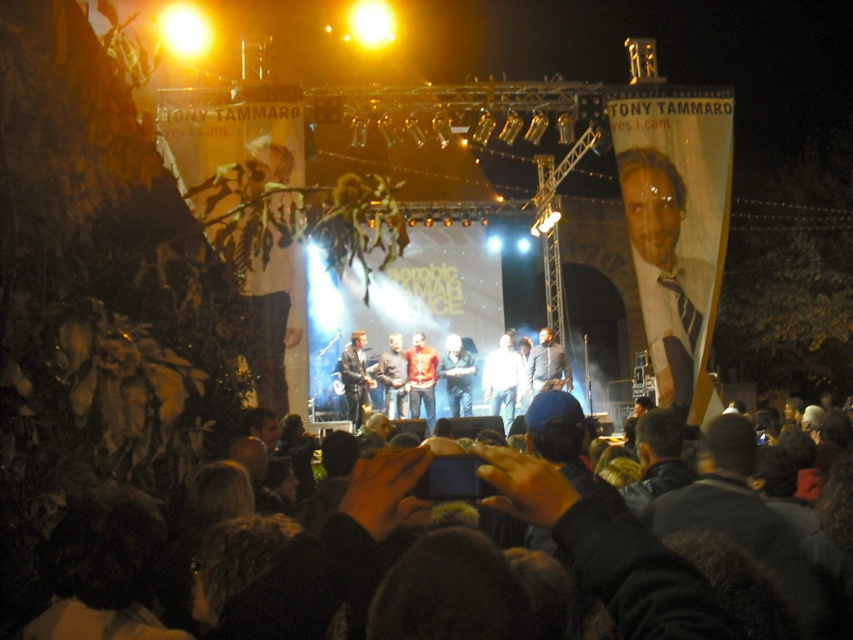
You are a photographer at the concert and want to capture a photo of both the blue striped tie at right and the leather jacket at center. Which object should you focus on first if you want to include both in the frame without moving the camera?

The blue striped tie at right is positioned on the right side of the leather jacket at center, so you should focus on the leather jacket at center first to ensure both objects are within the frame.

You are standing at point A located at coordinates point A at [351,396]. You need to walk to point B, which is 104.65 meters away. Is this distance reasonable for a 5 minute walk?

The distance between point A at [351,396] and point B is 104.65 meters. A typical walking speed is about 1.4 meters per second, so 104.65 meters would take approximately 75 seconds, which is less than 5 minutes. Therefore, yes, it is reasonable to walk this distance in 5 minutes.

You are a photographer at the event and need to capture a photo that includes both the dark clothing at lower center and the dark brown leather jacket at center. Based on their positions, which object should you position on the left side of your photo?

The dark clothing at lower center should be positioned on the left side of the photo since it is to the left of the dark brown leather jacket at center.